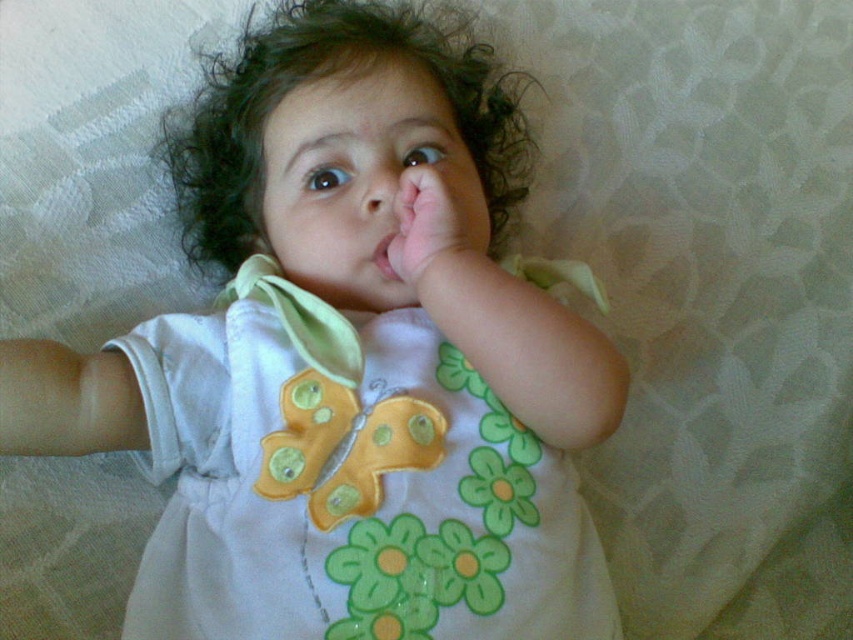
Question: Can you confirm if white fabric dress at center is positioned below pink smooth flesh at center?

Choices:
 (A) no
 (B) yes

Answer: (B)

Question: Which point is farther to the camera?

Choices:
 (A) pink smooth hand at center
 (B) white fabric dress at center
 (C) pink smooth flesh at center

Answer: (C)

Question: Where is smooth skin nose at center located in relation to pink smooth flesh at center in the image?

Choices:
 (A) right
 (B) left

Answer: (B)

Question: Which object appears closest to the camera in this image?

Choices:
 (A) white fabric dress at center
 (B) pink smooth flesh at center

Answer: (A)

Question: Is white fabric dress at center wider than pink smooth flesh at center?

Choices:
 (A) yes
 (B) no

Answer: (A)

Question: Estimate the real-world distances between objects in this image. Which object is closer to the pink smooth hand at center?

Choices:
 (A) smooth skin nose at center
 (B) pink smooth flesh at center
 (C) white fabric dress at center

Answer: (B)